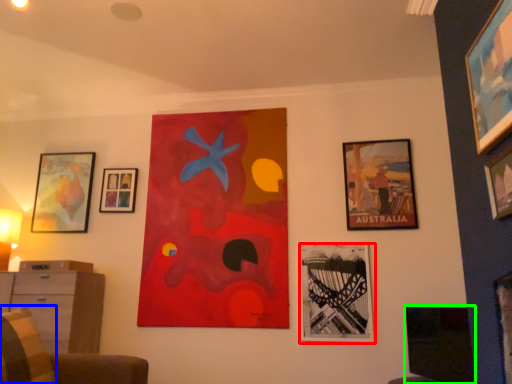
Question: Which is nearer to the picture frame (highlighted by a red box)? pillow (highlighted by a blue box) or picture frame (highlighted by a green box).

Choices:
 (A) pillow
 (B) picture frame

Answer: (B)